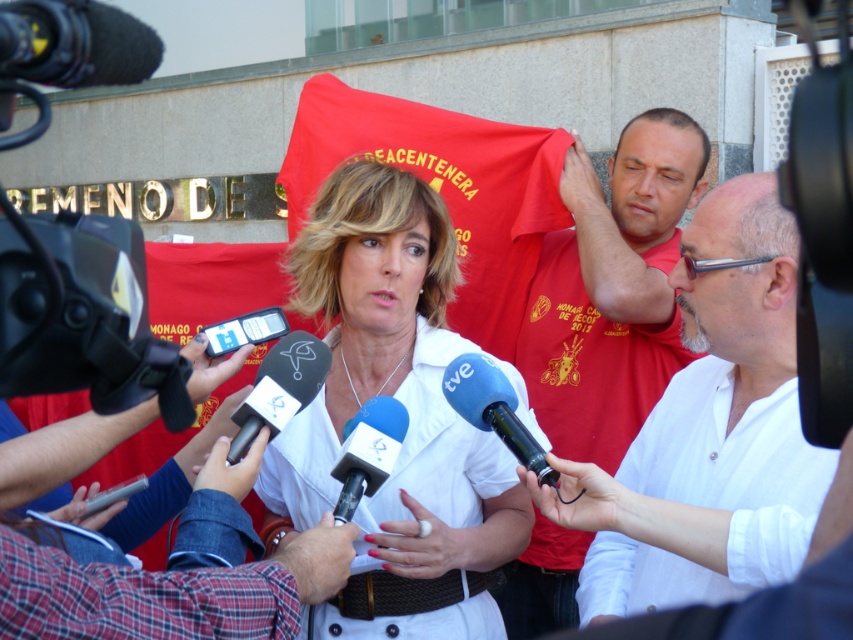
You are a photographer at the interview scene. You need to take a photo that clearly shows both the matte red shirt at center and the red fabric flag at center. However, the two red items are causing some confusion in the frame. Which object is located to the right of the other?

The matte red shirt at center is positioned on the right side of red fabric flag at center.

You are a photographer at the interview. You need to focus your camera on the matte red shirt at center and the red fabric flag at center. Which object should you adjust your focus to first if you want to capture both in sharp detail?

The matte red shirt at center is thinner than the red fabric flag at center, so you should focus on the thinner matte red shirt at center first to ensure both are in sharp detail.